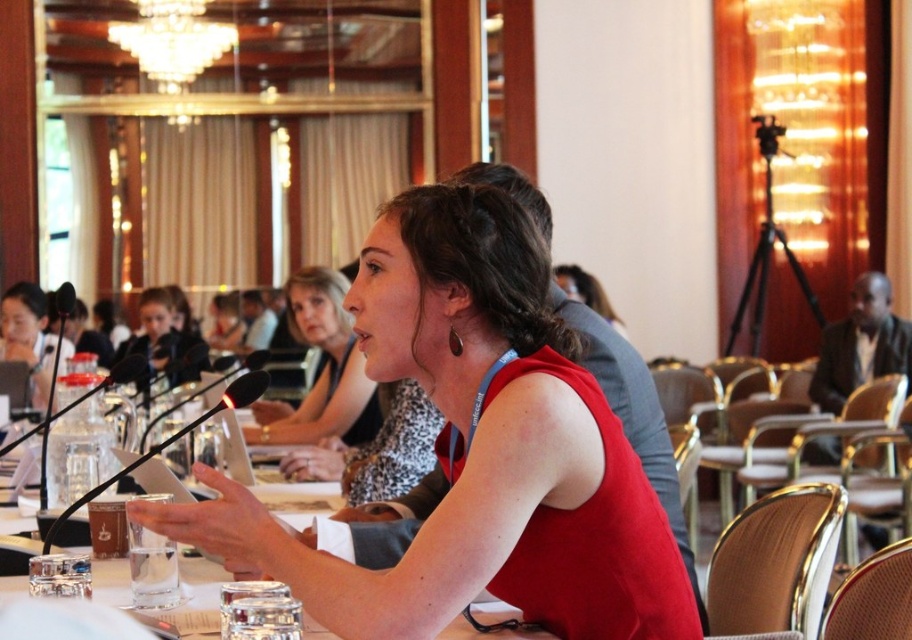
You are standing at the speaker position in the conference room. There are two points marked in the scene. The first point is at coordinate point (425,211) and the second point is at coordinate point (188,356). Which point is closer to you?

Point (425,211) is in front of point (188,356), so it is closer to you.

You are a photographer in the audience at this event. You want to take a photo that includes both the red satin dress at center and the matte black microphone at upper left. Which object will appear larger in your photo?

The red satin dress at center will appear larger in the photo because it is closer to the viewer than the matte black microphone at upper left.